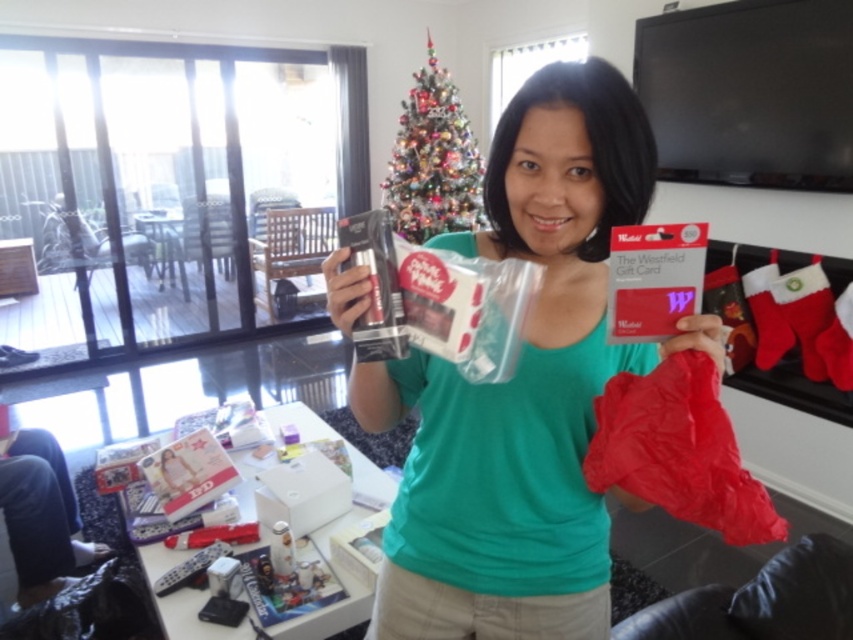
Question: Which point is farther from the camera taking this photo?

Choices:
 (A) (479, 196)
 (B) (593, 257)

Answer: (A)

Question: Which point is closer to the camera?

Choices:
 (A) (401, 208)
 (B) (518, 616)

Answer: (B)

Question: Is green matte shirt at center above shiny silver christmas tree at upper center?

Choices:
 (A) yes
 (B) no

Answer: (B)

Question: Is green matte shirt at center positioned in front of shiny silver christmas tree at upper center?

Choices:
 (A) yes
 (B) no

Answer: (A)

Question: Which point is farther to the camera?

Choices:
 (A) (556, 324)
 (B) (412, 148)

Answer: (B)

Question: Can you confirm if green matte shirt at center is positioned above shiny silver christmas tree at upper center?

Choices:
 (A) no
 (B) yes

Answer: (A)